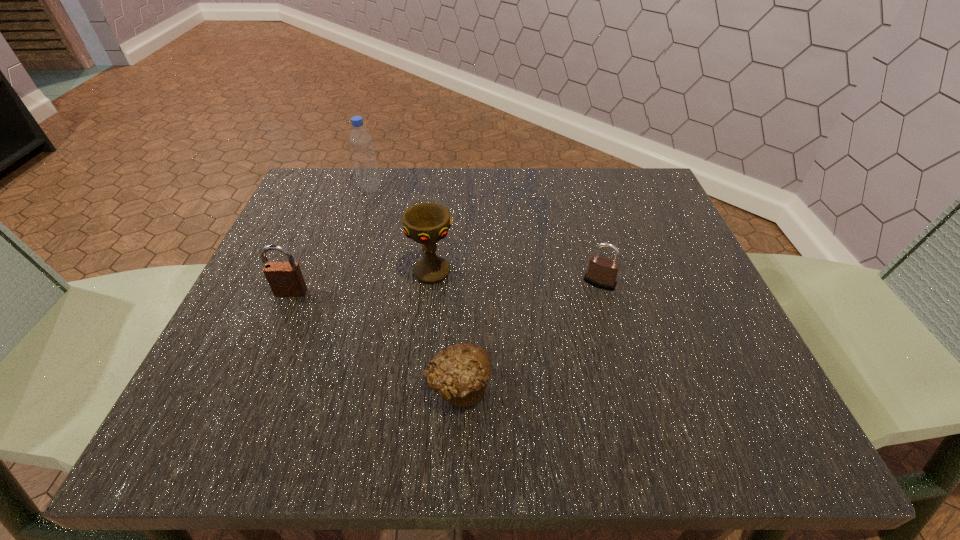
Where is `vacant point located 0.240m on the front-facing side of the leftmost object`? vacant point located 0.240m on the front-facing side of the leftmost object is located at coordinates (236, 421).

The image size is (960, 540). In order to click on vacant area situated 0.060m on the right of the rightmost object in this screenshot , I will do `click(648, 283)`.

You are a GUI agent. You are given a task and a screenshot of the screen. Output one action in this format:
    pyautogui.click(x=<x>, y=<y>)
    Task: Click on the vacant space located 0.190m on the left of the shortest object
    This screenshot has height=540, width=960.
    Given the screenshot: What is the action you would take?
    pyautogui.click(x=298, y=386)

The image size is (960, 540). Identify the location of object at the far edge. (361, 144).

Locate an element on the screen. This screenshot has height=540, width=960. object present at the near edge is located at coordinates (459, 374).

Find the location of a particular element. bottle located at the left edge is located at coordinates (361, 144).

This screenshot has width=960, height=540. Find the location of `padlock located at the left edge`. padlock located at the left edge is located at coordinates (285, 279).

This screenshot has height=540, width=960. What are the coordinates of `object located in the far left corner section of the desktop` in the screenshot? It's located at (361, 144).

The height and width of the screenshot is (540, 960). Identify the location of free spot at the far edge of the desktop. (566, 185).

In order to click on free space at the near edge in this screenshot , I will do `click(443, 401)`.